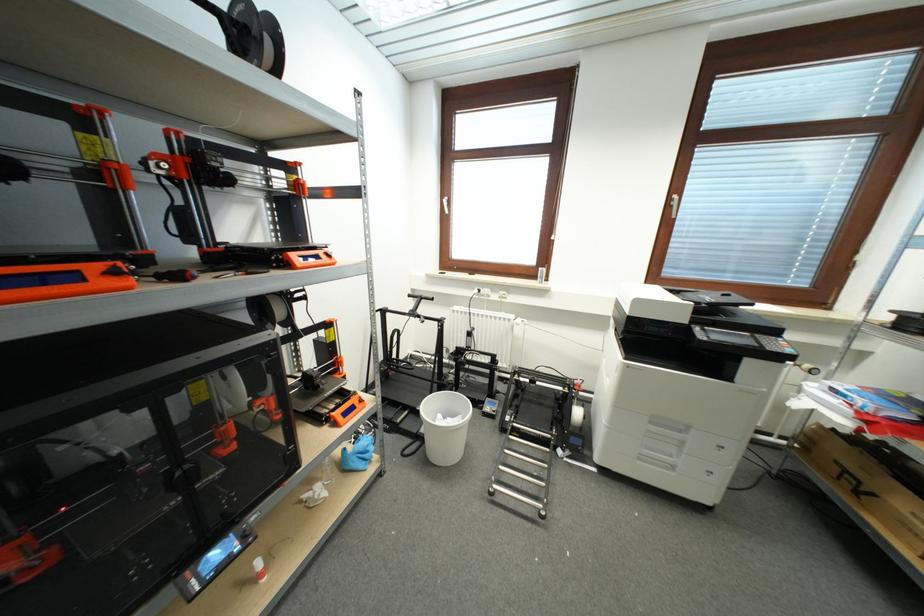
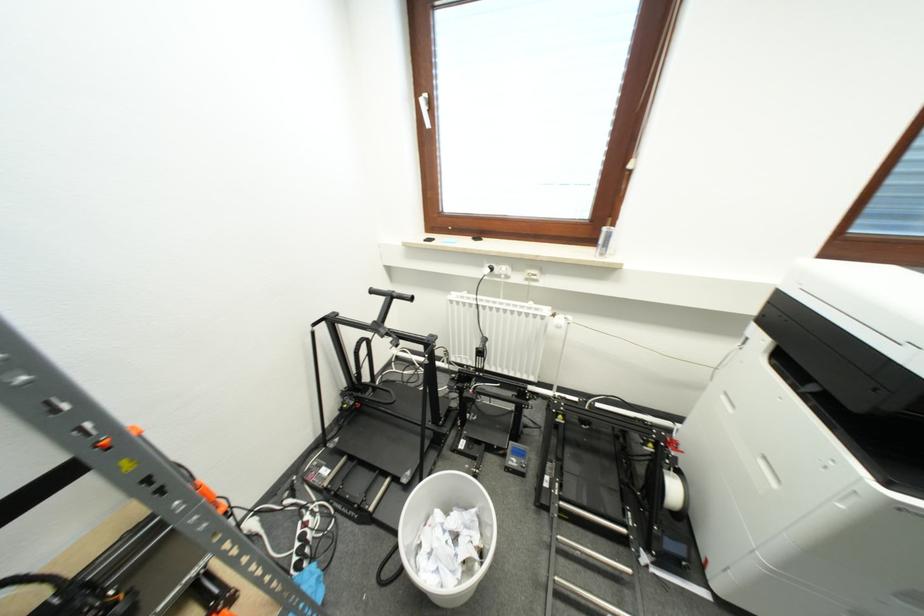
Question: In a continuous first-person perspective shot, in which direction is the camera moving?

Choices:
 (A) Left
 (B) Right
 (C) Forward
 (D) Backward

Answer: (C)